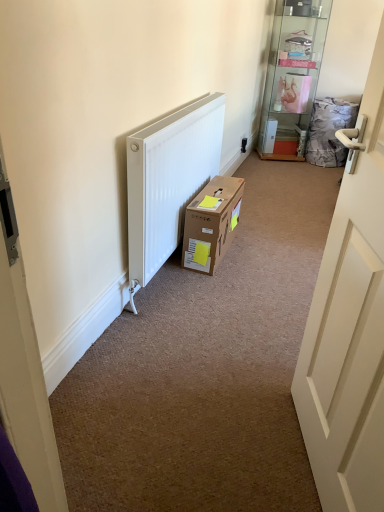
Question: Is white matte door at right positioned behind black plastic electric outlet at upper right?

Choices:
 (A) no
 (B) yes

Answer: (A)

Question: Considering the relative sizes of white matte door at right and black plastic electric outlet at upper right in the image provided, is white matte door at right taller than black plastic electric outlet at upper right?

Choices:
 (A) no
 (B) yes

Answer: (B)

Question: Does white matte door at right have a greater width compared to black plastic electric outlet at upper right?

Choices:
 (A) no
 (B) yes

Answer: (B)

Question: Is white matte door at right positioned beyond the bounds of black plastic electric outlet at upper right?

Choices:
 (A) yes
 (B) no

Answer: (A)

Question: From the image's perspective, would you say white matte door at right is shown under black plastic electric outlet at upper right?

Choices:
 (A) yes
 (B) no

Answer: (A)

Question: Does white matte door at right contain black plastic electric outlet at upper right?

Choices:
 (A) yes
 (B) no

Answer: (B)

Question: Can you see brown cardboard box at center touching clear glass shelf at upper right?

Choices:
 (A) yes
 (B) no

Answer: (B)

Question: Can you confirm if brown cardboard box at center is taller than clear glass shelf at upper right?

Choices:
 (A) no
 (B) yes

Answer: (A)

Question: Is brown cardboard box at center behind clear glass shelf at upper right?

Choices:
 (A) no
 (B) yes

Answer: (A)

Question: Considering the relative sizes of brown cardboard box at center and clear glass shelf at upper right in the image provided, is brown cardboard box at center thinner than clear glass shelf at upper right?

Choices:
 (A) no
 (B) yes

Answer: (B)

Question: Can you confirm if brown cardboard box at center is smaller than clear glass shelf at upper right?

Choices:
 (A) no
 (B) yes

Answer: (B)

Question: Is clear glass shelf at upper right completely or partially inside brown cardboard box at center?

Choices:
 (A) no
 (B) yes

Answer: (A)

Question: From a real-world perspective, is black plastic electric outlet at upper right over clear glass shelf at upper right?

Choices:
 (A) yes
 (B) no

Answer: (B)